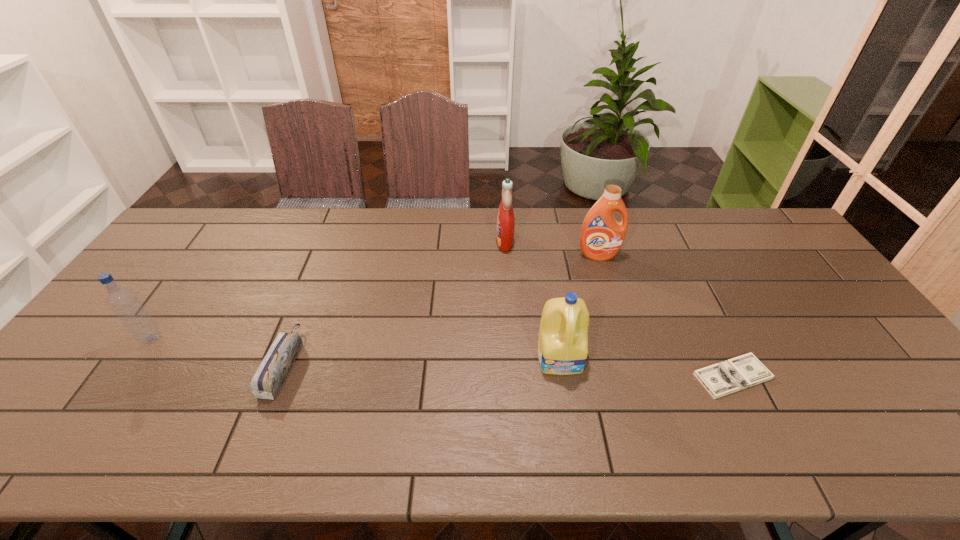
Where is `the rightmost detergent`? The height and width of the screenshot is (540, 960). the rightmost detergent is located at coordinates (601, 238).

Locate an element on the screen. the leftmost detergent is located at coordinates click(x=505, y=226).

At what (x,y) coordinates should I click in order to perform the action: click on water bottle. Please return your answer as a coordinate pair (x, y). The height and width of the screenshot is (540, 960). Looking at the image, I should click on (124, 303).

Identify the location of the third object from right to left. The image size is (960, 540). (563, 335).

You are a GUI agent. You are given a task and a screenshot of the screen. Output one action in this format:
    pyautogui.click(x=<x>, y=<y>)
    Task: Click on the nearest detergent
    The width and height of the screenshot is (960, 540).
    Given the screenshot: What is the action you would take?
    pyautogui.click(x=563, y=335)

Locate an element on the screen. The width and height of the screenshot is (960, 540). the fifth object from right to left is located at coordinates (270, 375).

This screenshot has height=540, width=960. I want to click on pencil box, so click(270, 375).

Identify the location of the shortest object. (741, 372).

You are a GUI agent. You are given a task and a screenshot of the screen. Output one action in this format:
    pyautogui.click(x=<x>, y=<y>)
    Task: Click on the dollar
    Image resolution: width=960 pixels, height=540 pixels.
    Given the screenshot: What is the action you would take?
    pyautogui.click(x=741, y=372)

Identify the location of free location located 0.210m on the front-facing side of the second object from right to left. (614, 308).